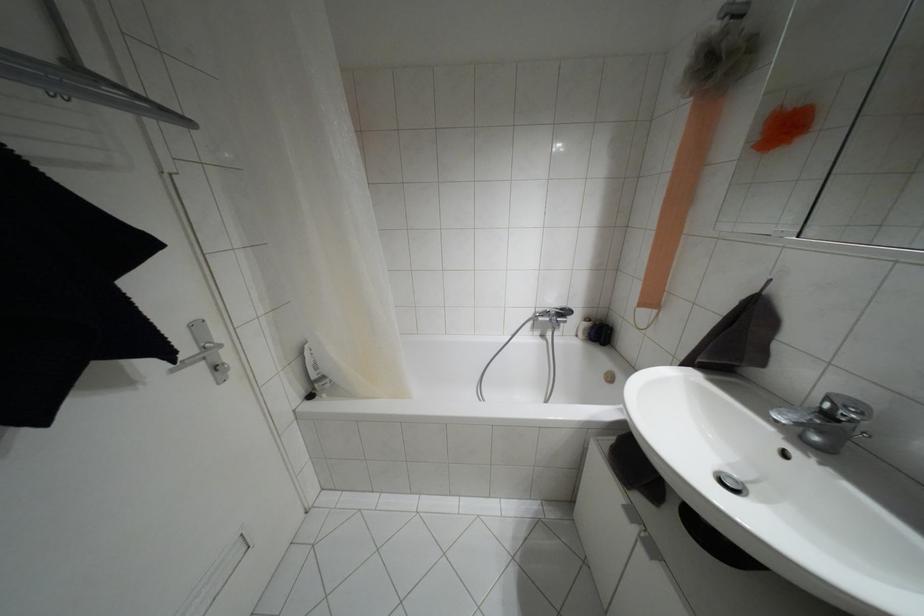
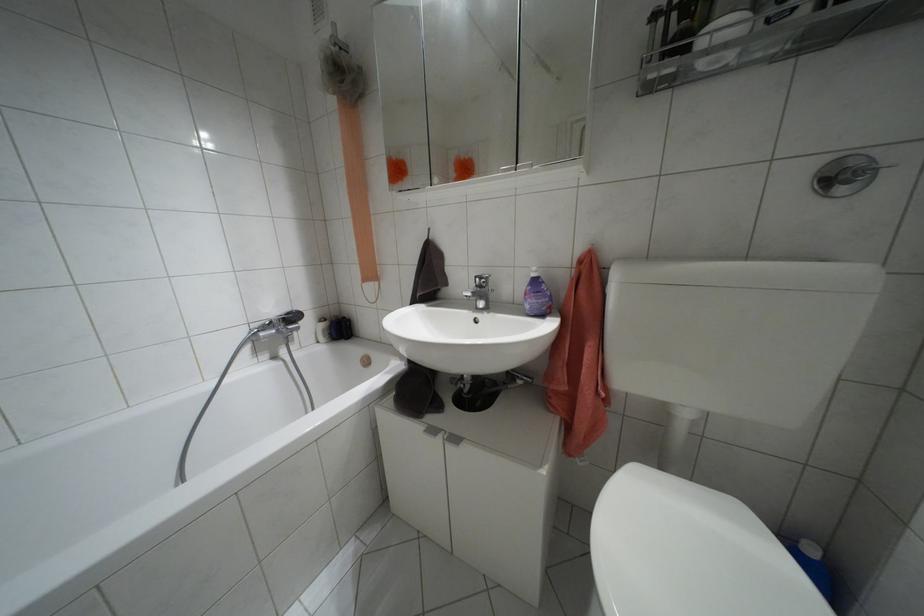
Question: How did the camera likely rotate?

Choices:
 (A) Left
 (B) Right
 (C) Up
 (D) Down

Answer: (B)